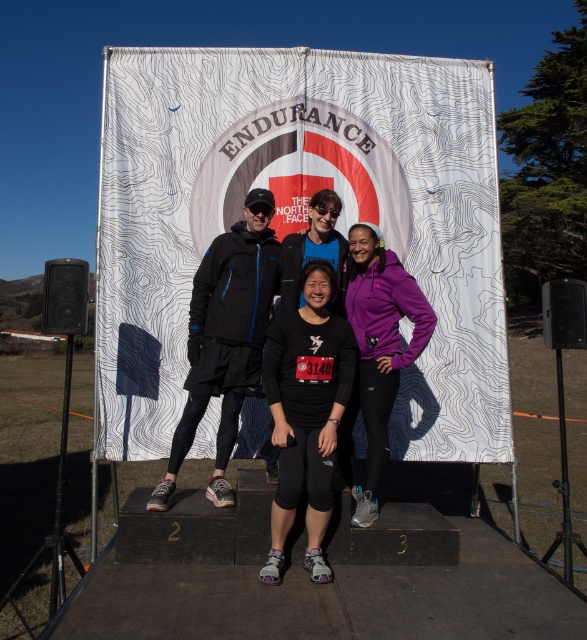
Who is more forward, (342, 380) or (406, 289)?

Point (342, 380)

Between black matte running outfit at center and purple fleece jacket at center, which one appears on the right side from the viewer's perspective?

purple fleece jacket at center is more to the right.

Which is behind, point (288, 369) or point (392, 392)?

Positioned behind is point (392, 392).

Identify the location of black matte running outfit at center. (306, 413).